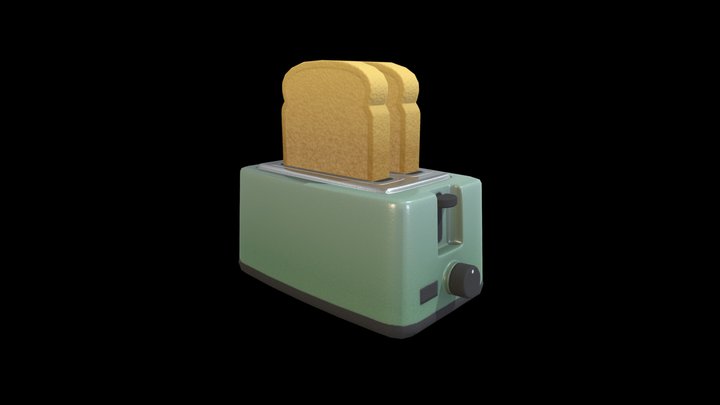
Locate an element on the screen. The height and width of the screenshot is (405, 720). front of toaster is located at coordinates (417, 232).